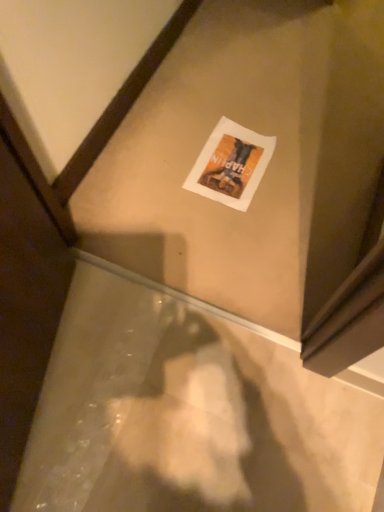
Identify the location of vacant area on top of white paper postcard at center (from a real-world perspective). The width and height of the screenshot is (384, 512). (230, 163).